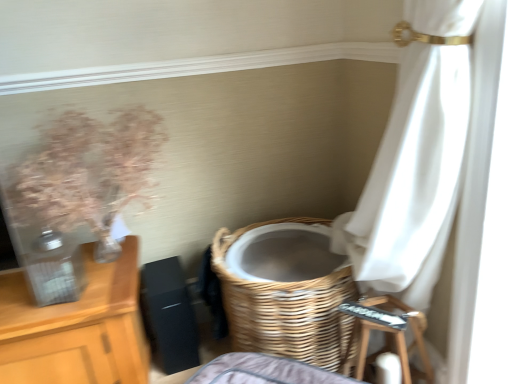
You are a GUI agent. You are given a task and a screenshot of the screen. Output one action in this format:
    pyautogui.click(x=<x>, y=<y>)
    Task: Click on the woven wood basket at lower center
    
    Given the screenshot: What is the action you would take?
    pyautogui.click(x=286, y=308)

Does translucent glass vase at left have a lesser width compared to woven wood basket at lower center?

Indeed, translucent glass vase at left has a lesser width compared to woven wood basket at lower center.

Are translucent glass vase at left and woven wood basket at lower center making contact?

No.

Can you tell me how much translucent glass vase at left and woven wood basket at lower center differ in facing direction?

The angular difference between translucent glass vase at left and woven wood basket at lower center is 32.8 degrees.

Does translucent glass vase at left lie in front of woven wood basket at lower center?

Yes.

Would you consider translucent glass vase at left to be distant from wooden step stool at lower right?

They are positioned close to each other.

In the scene shown: Which is more distant, [63,120] or [401,348]?

Point [401,348]

In terms of size, does translucent glass vase at left appear bigger or smaller than wooden step stool at lower right?

In the image, translucent glass vase at left appears to be larger than wooden step stool at lower right.

This screenshot has height=384, width=512. Find the location of `step stool below the translucent glass vase at left (from the image's perspective)`. step stool below the translucent glass vase at left (from the image's perspective) is located at coordinates (394, 339).

Does woven wood basket at lower center have a smaller size compared to translucent glass vase at left?

No.

Is woven wood basket at lower center at the right side of translucent glass vase at left?

Indeed, woven wood basket at lower center is positioned on the right side of translucent glass vase at left.

Locate an element on the screen. The image size is (512, 384). floral arrangement above the woven wood basket at lower center (from a real-world perspective) is located at coordinates (89, 173).

From the image's perspective, which one is positioned lower, woven wood basket at lower center or translucent glass vase at left?

woven wood basket at lower center, from the image's perspective.

From the image's perspective, between wooden step stool at lower right and translucent glass vase at left, who is located below?

wooden step stool at lower right appears lower in the image.

Is translucent glass vase at left surrounded by wooden step stool at lower right?

Definitely not — translucent glass vase at left is not inside wooden step stool at lower right.

How many degrees apart are the facing directions of wooden step stool at lower right and translucent glass vase at left?

The angular difference between wooden step stool at lower right and translucent glass vase at left is 39.6 degrees.

From the image's perspective, which object appears higher, wooden step stool at lower right or woven wood basket at lower center?

woven wood basket at lower center.

Are wooden step stool at lower right and woven wood basket at lower center located far from each other?

No, wooden step stool at lower right is not far away from woven wood basket at lower center.

Is woven wood basket at lower center surrounded by wooden step stool at lower right?

No.

Is wooden step stool at lower right positioned with its back to woven wood basket at lower center?

No.

Is woven wood basket at lower center facing away from wooden step stool at lower right?

No, woven wood basket at lower center's orientation is not away from wooden step stool at lower right.

From a real-world perspective, between woven wood basket at lower center and wooden step stool at lower right, who is vertically higher?

From a 3D spatial view, woven wood basket at lower center is above.

Is point (321, 323) more distant than point (361, 330)?

No, it is in front of (361, 330).

Is woven wood basket at lower center shorter than wooden step stool at lower right?

Incorrect, the height of woven wood basket at lower center does not fall short of that of wooden step stool at lower right.

The height and width of the screenshot is (384, 512). Find the location of `floral arrangement above the woven wood basket at lower center (from the image's perspective)`. floral arrangement above the woven wood basket at lower center (from the image's perspective) is located at coordinates (89, 173).

Where is `step stool that appears below the translucent glass vase at left (from the image's perspective)`? This screenshot has width=512, height=384. step stool that appears below the translucent glass vase at left (from the image's perspective) is located at coordinates (394, 339).

From the picture: Considering their positions, is translucent glass vase at left positioned closer to woven wood basket at lower center than wooden step stool at lower right?

Based on the image, wooden step stool at lower right appears to be nearer to woven wood basket at lower center.

In the scene shown: From the image, which object appears to be nearer to wooden step stool at lower right, translucent glass vase at left or woven wood basket at lower center?

Based on the image, woven wood basket at lower center appears to be nearer to wooden step stool at lower right.

Based on their spatial positions, is wooden step stool at lower right or woven wood basket at lower center further from translucent glass vase at left?

Among the two, wooden step stool at lower right is located further to translucent glass vase at left.

When comparing their distances from woven wood basket at lower center, does wooden step stool at lower right or translucent glass vase at left seem further?

Among the two, translucent glass vase at left is located further to woven wood basket at lower center.

Based on their spatial positions, is woven wood basket at lower center or translucent glass vase at left further from wooden step stool at lower right?

The object further to wooden step stool at lower right is translucent glass vase at left.

Which object lies further to the anchor point translucent glass vase at left, woven wood basket at lower center or wooden step stool at lower right?

wooden step stool at lower right lies further to translucent glass vase at left than the other object.

You are a GUI agent. You are given a task and a screenshot of the screen. Output one action in this format:
    pyautogui.click(x=<x>, y=<y>)
    Task: Click on the basket between translucent glass vase at left and wooden step stool at lower right
    This screenshot has height=384, width=512.
    Given the screenshot: What is the action you would take?
    pos(286,308)